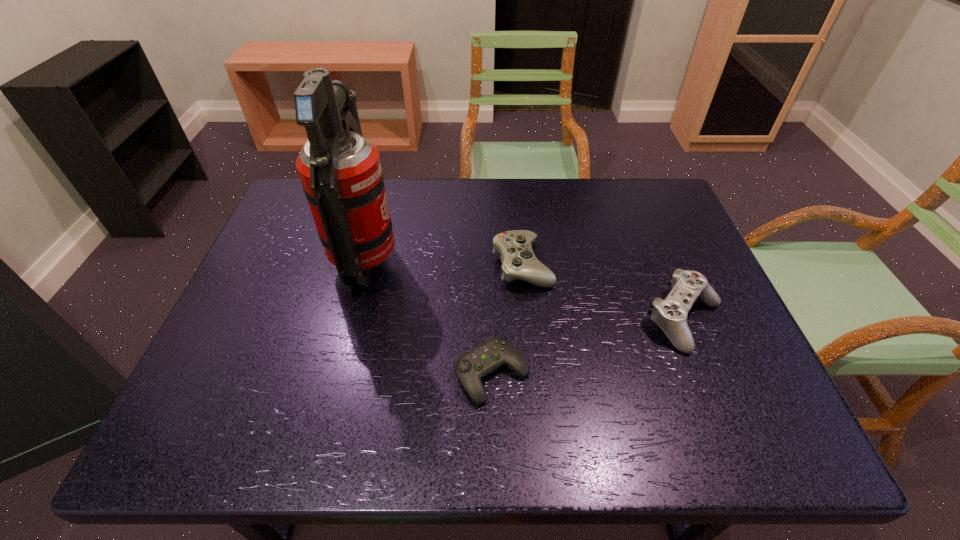
This screenshot has height=540, width=960. In the image, there is a desktop. In order to click on vacant space at the near edge in this screenshot , I will do `click(266, 422)`.

The image size is (960, 540). In the image, there is a desktop. What are the coordinates of `vacant space at the left edge` in the screenshot? It's located at (300, 307).

In the image, there is a desktop. At what (x,y) coordinates should I click in order to perform the action: click on vacant space at the near left corner. Please return your answer as a coordinate pair (x, y). Looking at the image, I should click on (204, 416).

Where is `vacant space at the far right corner`? This screenshot has height=540, width=960. vacant space at the far right corner is located at coordinates (655, 191).

The height and width of the screenshot is (540, 960). In order to click on free space between the shortest control and the leftmost object in this screenshot , I will do `click(429, 317)`.

I want to click on vacant region between the rightmost object and the leftmost object, so click(x=525, y=290).

Image resolution: width=960 pixels, height=540 pixels. Identify the location of vacant region between the leftmost object and the rightmost control. (525, 290).

At what (x,y) coordinates should I click in order to perform the action: click on unoccupied position between the shortest object and the rightmost control. Please return your answer as a coordinate pair (x, y). The width and height of the screenshot is (960, 540). Looking at the image, I should click on (588, 347).

Identify the location of object that is the closest one to the shortest object. (519, 262).

The width and height of the screenshot is (960, 540). I want to click on the closest object to the tallest object, so click(470, 367).